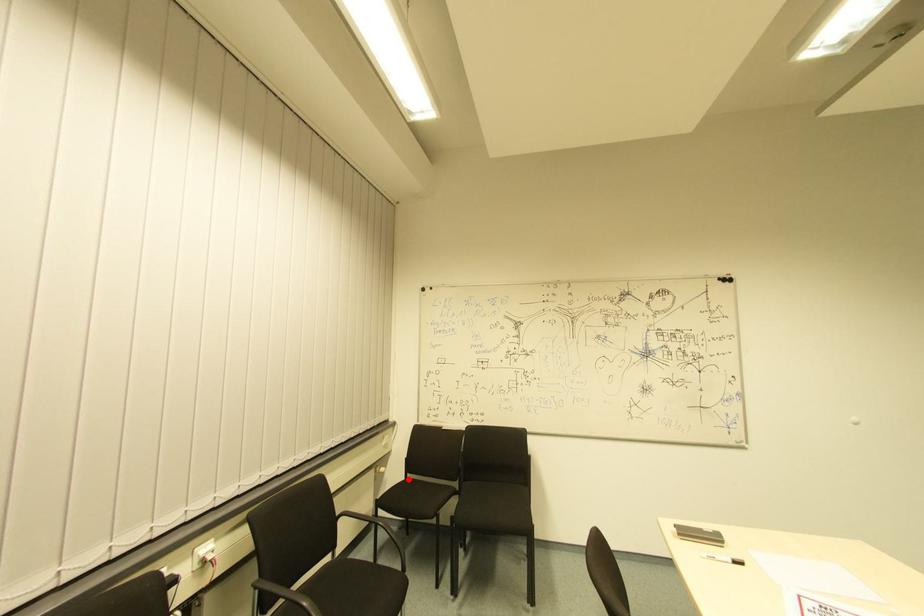
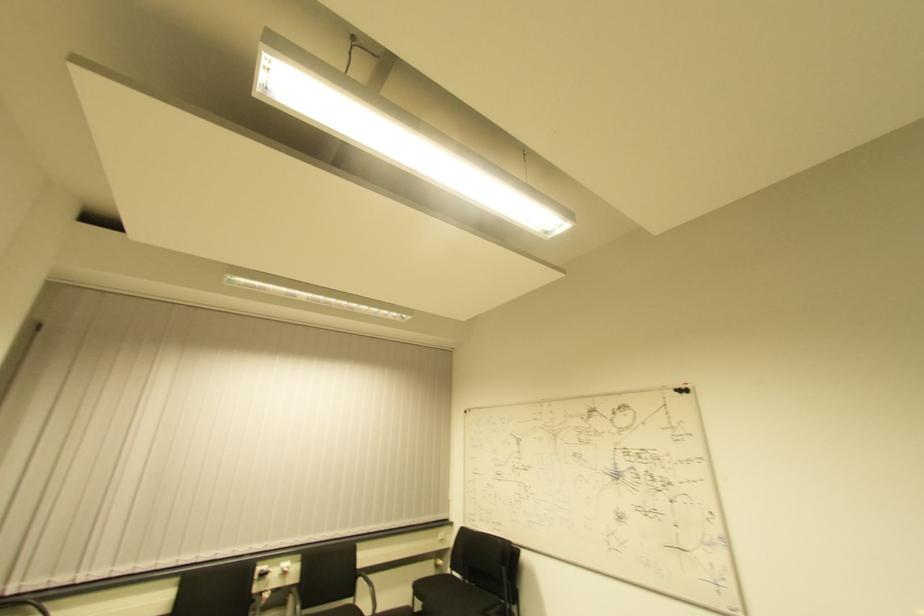
Question: I am providing you with two images of the same scene from different viewpoints. In image1, a red point is highlighted. Considering the same 3D point in image2, which of the following is correct?

Choices:
 (A) It is closer
 (B) It is farther

Answer: (A)